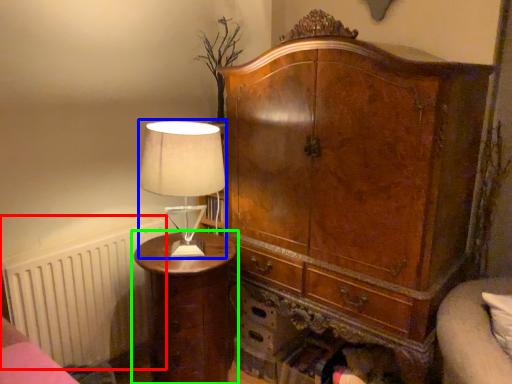
Question: Which is nearer to the radiator (highlighted by a red box)? table lamp (highlighted by a blue box) or nightstand (highlighted by a green box).

Choices:
 (A) table lamp
 (B) nightstand

Answer: (B)